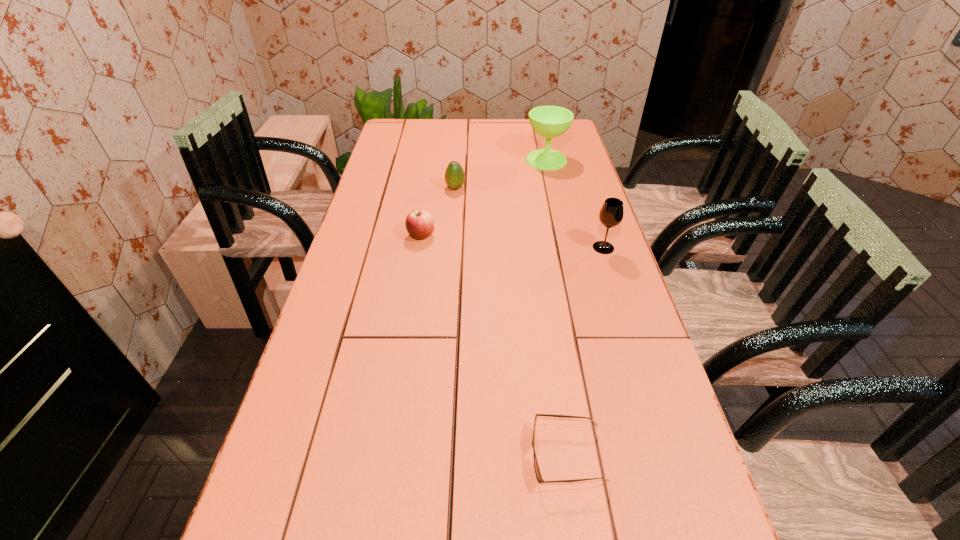
You are a GUI agent. You are given a task and a screenshot of the screen. Output one action in this format:
    pyautogui.click(x=<x>, y=<y>)
    Task: Click on the farther wineglass
    This screenshot has height=540, width=960.
    Given the screenshot: What is the action you would take?
    pyautogui.click(x=548, y=121)

The image size is (960, 540). I want to click on the nearer wineglass, so [611, 213].

Locate an element on the screen. Image resolution: width=960 pixels, height=540 pixels. the fourth nearest object is located at coordinates (454, 175).

Identify the location of the second object from left to right. (454, 175).

Where is `the leftmost object`? the leftmost object is located at coordinates (419, 223).

This screenshot has width=960, height=540. I want to click on the fourth tallest object, so click(419, 223).

You are a GUI agent. You are given a task and a screenshot of the screen. Output one action in this format:
    pyautogui.click(x=<x>, y=<y>)
    Task: Click on the shortest object
    Image resolution: width=960 pixels, height=540 pixels.
    Given the screenshot: What is the action you would take?
    pyautogui.click(x=536, y=467)

At what (x,y) coordinates should I click in order to perform the action: click on the nearest object. Please return your answer as a coordinate pair (x, y). This screenshot has height=540, width=960. Looking at the image, I should click on click(536, 467).

Where is `vacant space located on the back of the farthest object`? vacant space located on the back of the farthest object is located at coordinates (540, 134).

At what (x,y) coordinates should I click in order to perform the action: click on vacant space located 0.160m on the front of the nearer wineglass. Please return your answer as a coordinate pair (x, y). The height and width of the screenshot is (540, 960). Looking at the image, I should click on (618, 294).